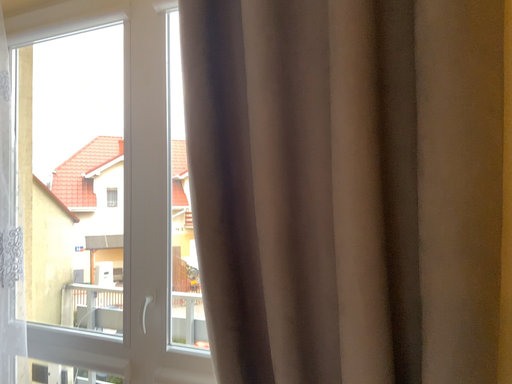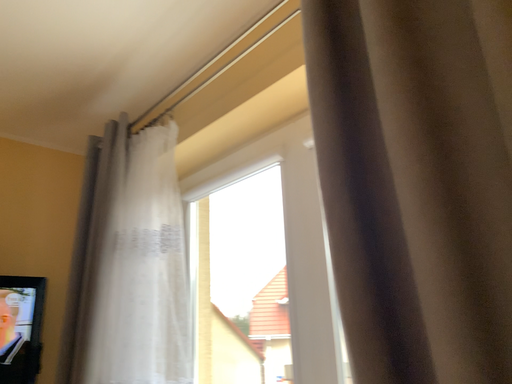
Question: Which way did the camera rotate in the video?

Choices:
 (A) rotated downward
 (B) rotated upward

Answer: (B)